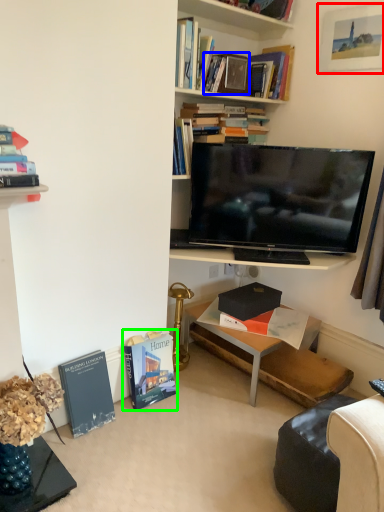
Question: Which object is the closest to the picture frame (highlighted by a red box)? Choose among these: book (highlighted by a blue box) or book (highlighted by a green box).

Choices:
 (A) book
 (B) book

Answer: (A)